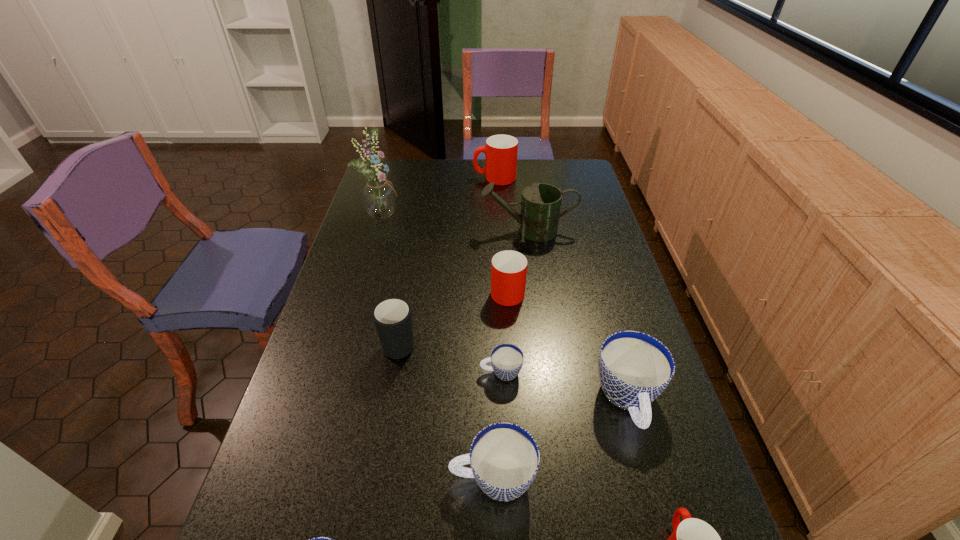
Locate an element on the screen. vacant area that lies between the third nearest cup and the farthest object is located at coordinates (493, 329).

Image resolution: width=960 pixels, height=540 pixels. Find the location of `vacant region between the eighth farthest object and the mug`. vacant region between the eighth farthest object and the mug is located at coordinates (446, 410).

Identify which object is the sixth closest to the third biggest blue cup. Please provide its 2D coordinates. Your answer should be formatted as a tuple, i.e. [(x, y)], where the tuple contains the x and y coordinates of a point satisfying the conditions above.

[(508, 268)]

Where is `the sixth closest object relative to the mug`? This screenshot has height=540, width=960. the sixth closest object relative to the mug is located at coordinates (635, 368).

Identify which cup is located as the third nearest to the smallest red cup. Please provide its 2D coordinates. Your answer should be formatted as a tuple, i.e. [(x, y)], where the tuple contains the x and y coordinates of a point satisfying the conditions above.

[(506, 359)]

Identify which cup is the fifth closest to the shortest cup. Please provide its 2D coordinates. Your answer should be formatted as a tuple, i.e. [(x, y)], where the tuple contains the x and y coordinates of a point satisfying the conditions above.

[(317, 539)]

Identify which red cup is the third nearest to the mug. Please provide its 2D coordinates. Your answer should be formatted as a tuple, i.e. [(x, y)], where the tuple contains the x and y coordinates of a point satisfying the conditions above.

[(500, 151)]

Where is `red cup that stands as the second closest to the tallest cup`? The image size is (960, 540). red cup that stands as the second closest to the tallest cup is located at coordinates [692, 539].

I want to click on blue cup that is the fourth closest to the bouquet, so click(x=317, y=539).

You are a GUI agent. You are given a task and a screenshot of the screen. Output one action in this format:
    pyautogui.click(x=<x>, y=<y>)
    Task: Click on the blue cup that is the fourth closest to the smallest red cup
    The image size is (960, 540).
    Given the screenshot: What is the action you would take?
    pyautogui.click(x=317, y=539)